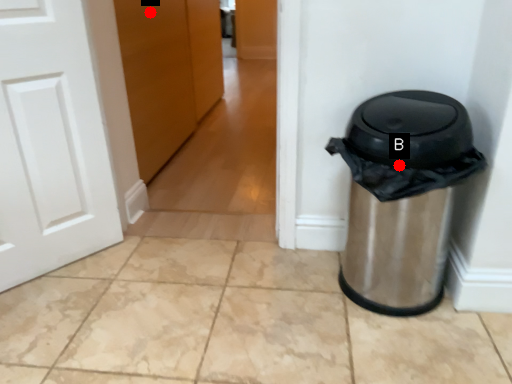
Question: Two points are circled on the image, labeled by A and B beside each circle. Which point is farther to the camera?

Choices:
 (A) A is further
 (B) B is further

Answer: (A)